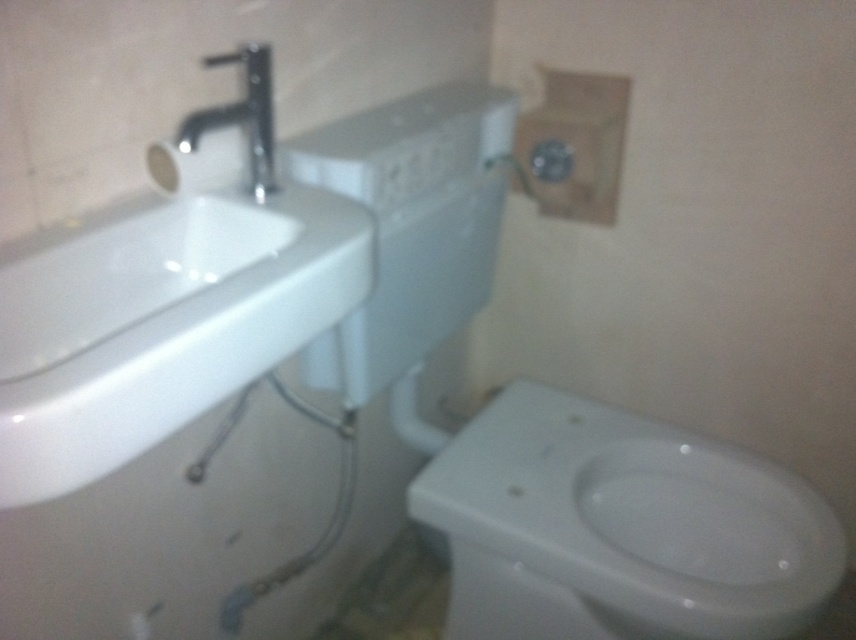
You are a plumber inspecting a bathroom. You need to install a new pipe connection between the white glossy bidet at lower right and the white glossy sink at upper left. Considering their sizes, which one might require more space for the installation?

The white glossy bidet at lower right has a larger size compared to the white glossy sink at upper left, so it might require more space for the installation.

You are a plumber trying to install a new pipe that needs to connect the polished chrome faucet at upper left to the white glossy bidet at lower right. The pipe you have is 25 inches long. Will it be long enough to make the connection?

The distance between the polished chrome faucet at upper left and the white glossy bidet at lower right is 26.11 inches. Since the pipe is only 25 inches long, it will not be long enough to make the connection.

You are a plumber working on a bathroom repair. You need to install a new faucet that requires 6 inches of clearance between the sink and the faucet. Based on the image, will the current spacing between the white glossy sink at upper left and the polished chrome faucet at upper left allow for this installation?

The white glossy sink at upper left and polished chrome faucet at upper left are 6.32 inches apart, which exceeds the required 6 inches of clearance. Therefore, the current spacing allows for the installation.